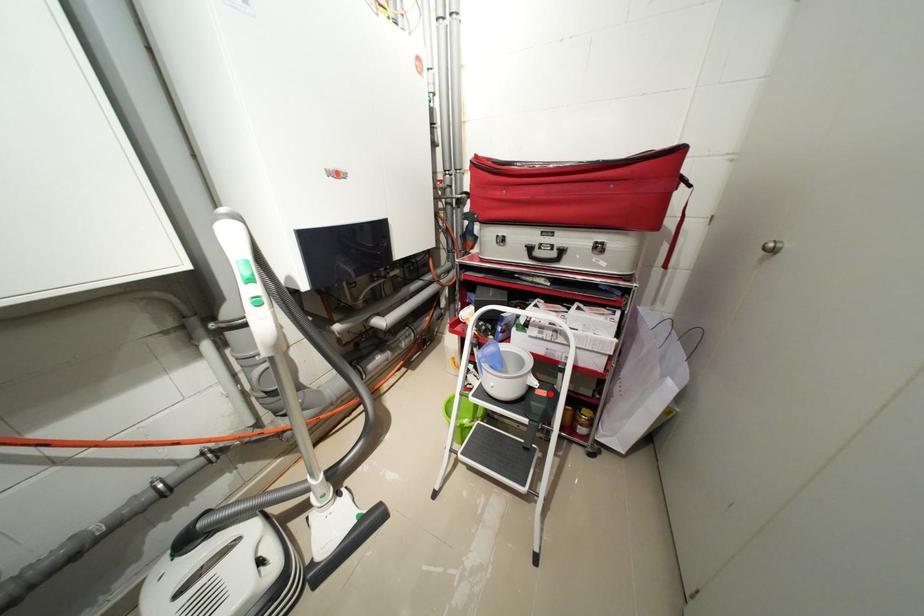
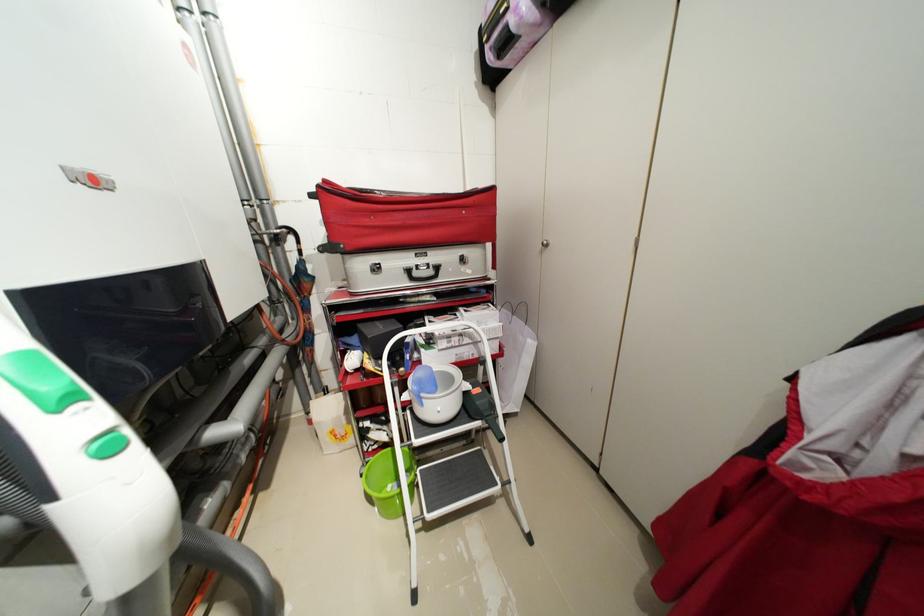
In the second image, find the point that corresponds to the highlighted location in the first image.

(484, 391)